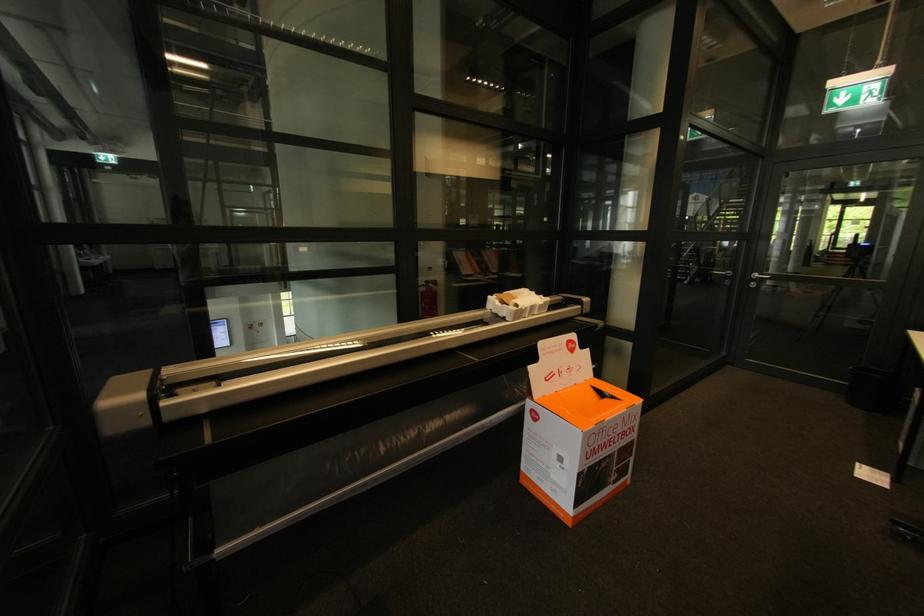
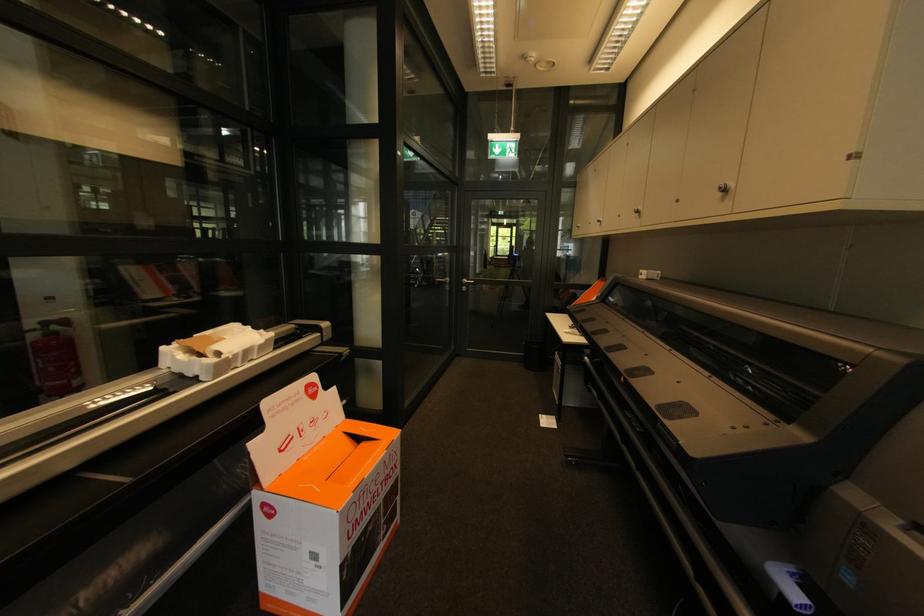
The point at (x=505, y=315) is marked in the first image. Where is the corresponding point in the second image?

(195, 376)